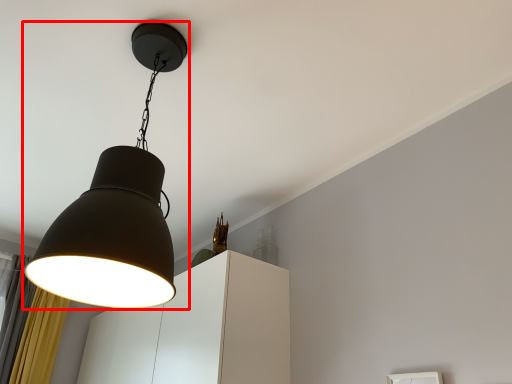
Question: From the image's perspective, what is the correct spatial positioning of lamp (annotated by the red box) in reference to cabinetry?

Choices:
 (A) above
 (B) below

Answer: (A)